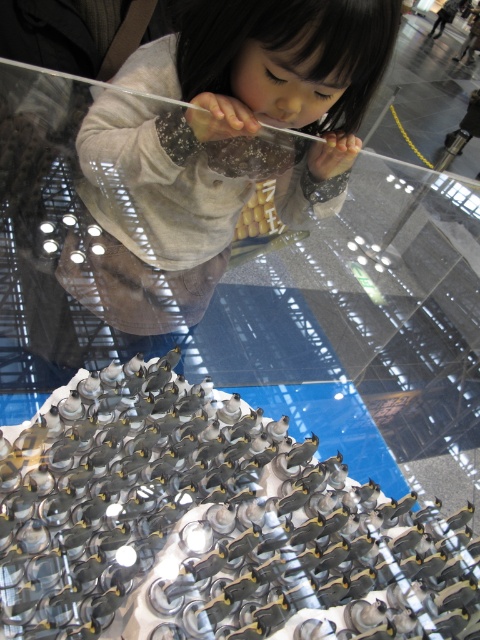
Question: Where is metallic silver sculpture at center located in relation to matte gray hoodie at upper center in the image?

Choices:
 (A) right
 (B) left

Answer: (A)

Question: Does metallic silver sculpture at center appear over matte gray hoodie at upper center?

Choices:
 (A) yes
 (B) no

Answer: (B)

Question: Which point is farther to the camera?

Choices:
 (A) (206, 417)
 (B) (109, 136)

Answer: (A)

Question: Can you confirm if metallic silver sculpture at center is positioned below matte gray hoodie at upper center?

Choices:
 (A) yes
 (B) no

Answer: (A)

Question: Which point is closer to the camera taking this photo?

Choices:
 (A) (339, 120)
 (B) (216, 484)

Answer: (B)